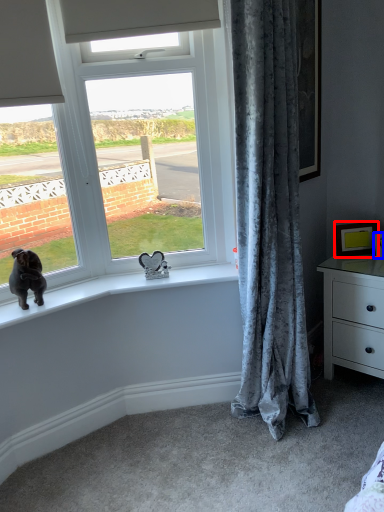
Question: Which of the following is the farthest to the observer, picture frame (highlighted by a red box) or picture frame (highlighted by a blue box)?

Choices:
 (A) picture frame
 (B) picture frame

Answer: (A)